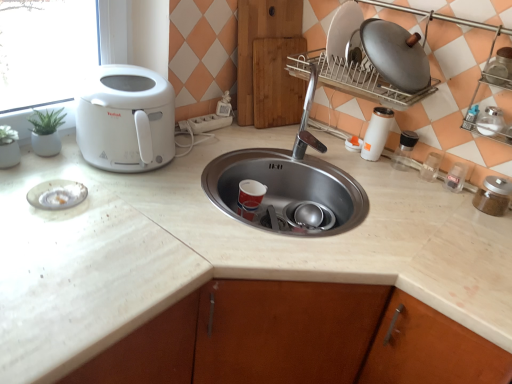
Locate an element on the screen. Image resolution: width=512 pixels, height=384 pixels. vacant space in front of white plastic soap dispenser at upper right, the first appliance positioned from the left is located at coordinates (355, 159).